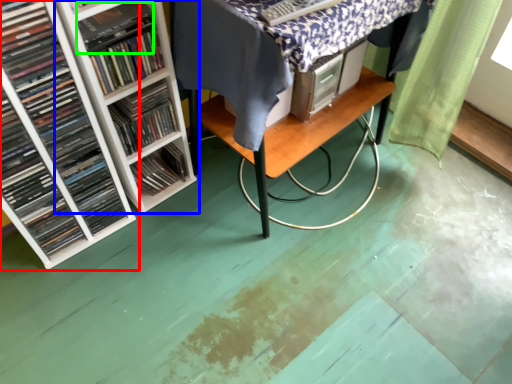
Question: Considering the real-world distances, which object is farthest from book (highlighted by a red box)? shelf (highlighted by a blue box) or paperback book (highlighted by a green box)?

Choices:
 (A) shelf
 (B) paperback book

Answer: (B)